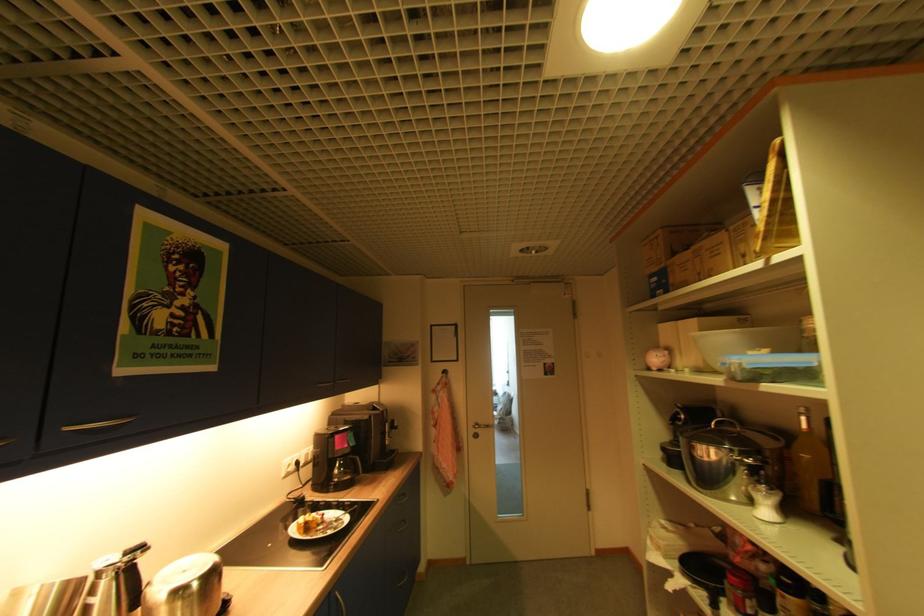
The image size is (924, 616). I want to click on pot lid handle, so click(724, 421).